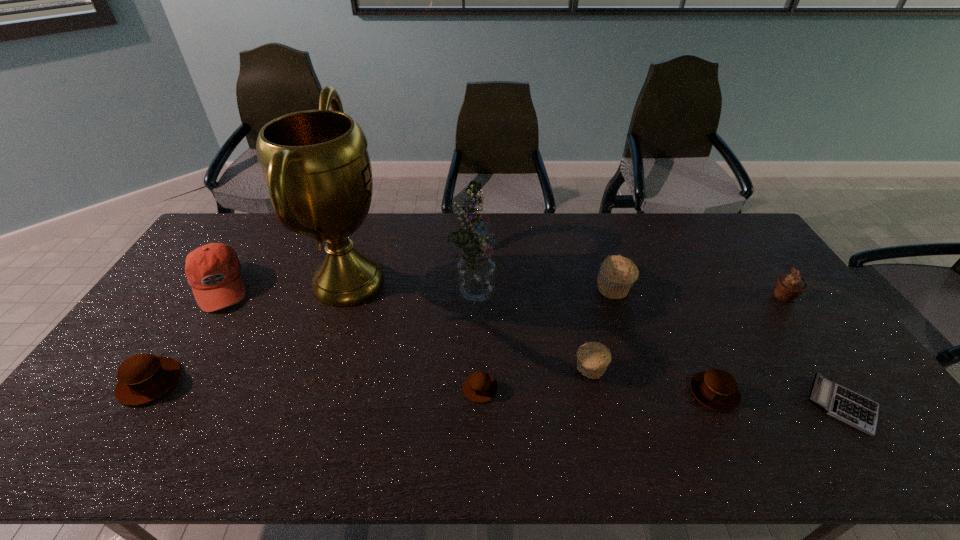
Locate an element on the screen. vacant space in between the eighth object from right to left and the baseball cap is located at coordinates (284, 284).

Where is `empty space that is in between the right beige muffin and the smaller beige muffin`? This screenshot has height=540, width=960. empty space that is in between the right beige muffin and the smaller beige muffin is located at coordinates coord(602,329).

You are a GUI agent. You are given a task and a screenshot of the screen. Output one action in this format:
    pyautogui.click(x=<x>, y=<y>)
    Task: Click on the free point between the fourth object from right to left and the smaller beige muffin
    The height and width of the screenshot is (540, 960).
    Given the screenshot: What is the action you would take?
    pyautogui.click(x=602, y=329)

Identify the location of object that is the ninth closest to the third object from left to right. (789, 286).

Identify which object is the fourth closest to the rightmost muffin. Please provide its 2D coordinates. Your answer should be formatted as a tuple, i.e. [(x, y)], where the tuple contains the x and y coordinates of a point satisfying the conditions above.

[(593, 358)]

Locate an element on the screen. This screenshot has width=960, height=540. muffin identified as the closest to the rightmost muffin is located at coordinates (716, 389).

Identify the location of muffin that can be found as the fifth closest to the tallest object. (716, 389).

Identify which brown muffin is located as the third nearest to the seventh object from left to right. Please provide its 2D coordinates. Your answer should be formatted as a tuple, i.e. [(x, y)], where the tuple contains the x and y coordinates of a point satisfying the conditions above.

[(143, 378)]

Select which brown muffin is the second closest to the leftmost muffin. Please provide its 2D coordinates. Your answer should be formatted as a tuple, i.e. [(x, y)], where the tuple contains the x and y coordinates of a point satisfying the conditions above.

[(716, 389)]

The width and height of the screenshot is (960, 540). In order to click on blank space that satisfies the following two spatial constraints: 1. on the surface of the shortest object with symbols; 2. on the left side of the third object from left to right in this screenshot , I will do `click(308, 404)`.